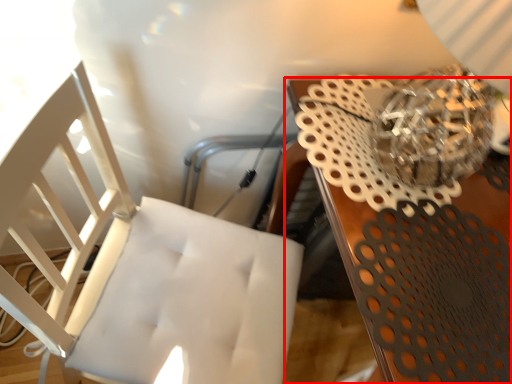
Question: Observing the image, what is the correct spatial positioning of table (annotated by the red box) in reference to chair?

Choices:
 (A) left
 (B) right

Answer: (B)